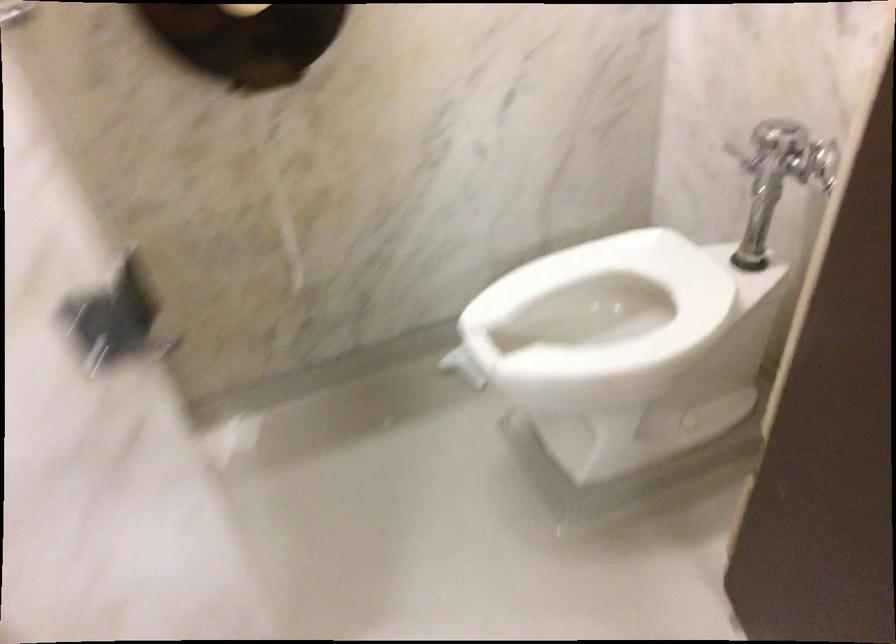
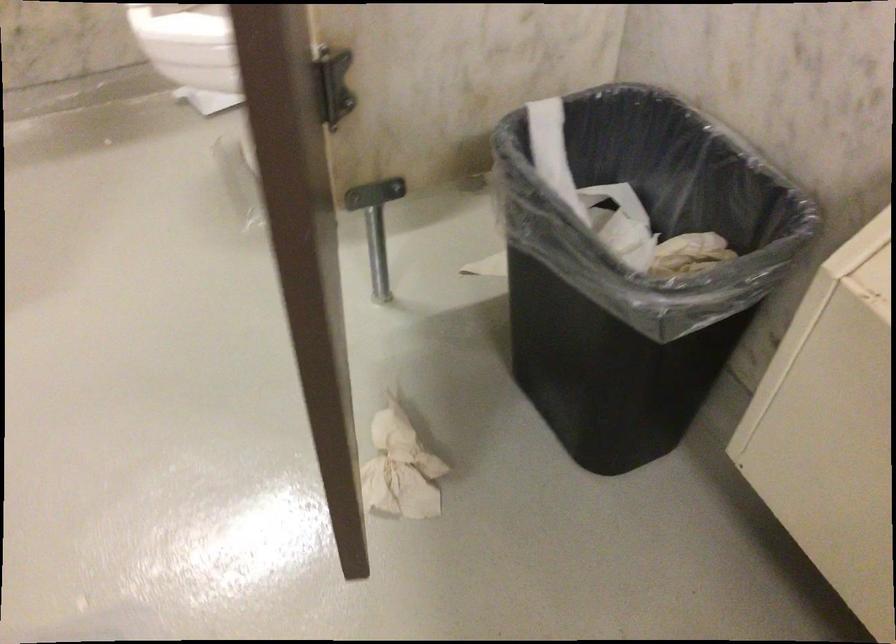
Question: How did the camera likely rotate?

Choices:
 (A) Left
 (B) Right
 (C) Up
 (D) Down

Answer: (D)